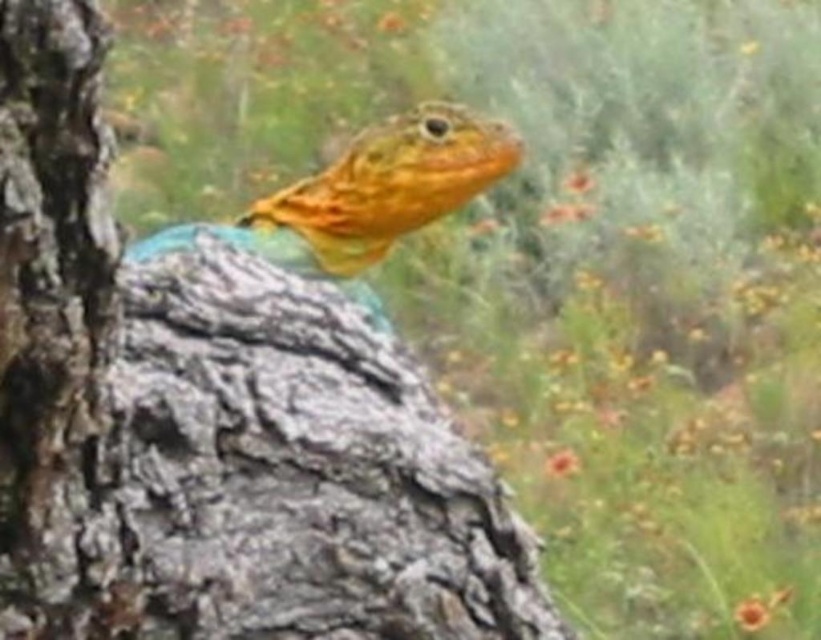
Is smooth bark tree trunk at center positioned before shiny orange lizard at center?

Yes.

I want to click on smooth bark tree trunk at center, so click(211, 419).

What are the coordinates of `smooth bark tree trunk at center` in the screenshot? It's located at (211, 419).

The width and height of the screenshot is (821, 640). I want to click on smooth bark tree trunk at center, so click(x=211, y=419).